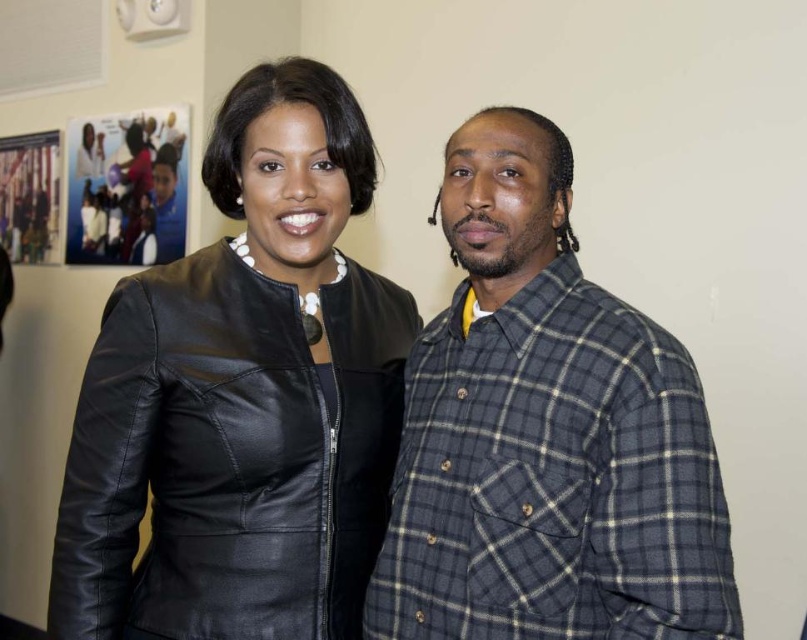
You are at an event and want to take a photo of both the point at coordinates [169,432] and the point at coordinates [573,632]. Which point should you focus on first to ensure both are in focus?

You should focus on the point at coordinates [169,432] first because it is closer to the viewer than the point at coordinates [573,632]. This way, adjusting the focus from near to far will help both points be in focus.